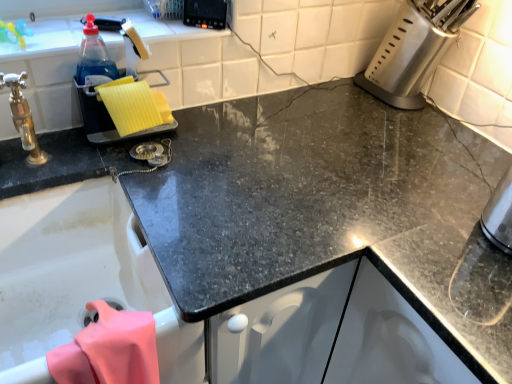
Image resolution: width=512 pixels, height=384 pixels. Find the location of `free space above pink fabric at lower left (from a real-world perspective)`. free space above pink fabric at lower left (from a real-world perspective) is located at coordinates (100, 334).